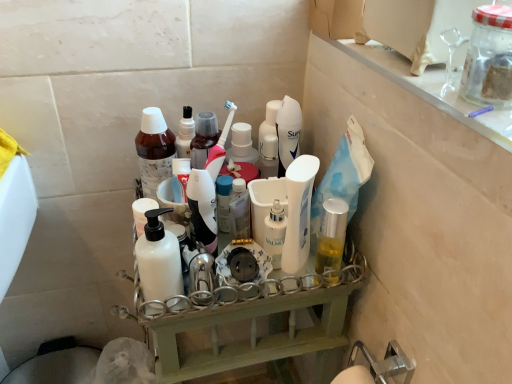
Image resolution: width=512 pixels, height=384 pixels. I want to click on white matte bottle at center, which ranks as the first bottle in bottom-to-top order, so click(158, 262).

What do you see at coordinates (298, 212) in the screenshot?
I see `white glossy lotion at center` at bounding box center [298, 212].

Find the location of `white glossy lotion at center`. white glossy lotion at center is located at coordinates (298, 212).

Measure the distance between point (276, 266) and camera.

Point (276, 266) is 28.07 inches away from camera.

You are a GUI agent. You are given a task and a screenshot of the screen. Output one action in this format:
    pyautogui.click(x=<x>, y=<y>)
    Task: Click on the clear glass shelf at upper right
    This screenshot has width=512, height=384.
    Given the screenshot: What is the action you would take?
    pyautogui.click(x=426, y=87)

Is white glossy lotion at center, arranged as the 1th toiletry when viewed from the left, in front of or behind white glossy lotion at center in the image?

In the image, white glossy lotion at center, arranged as the 1th toiletry when viewed from the left, appears behind white glossy lotion at center.

Which is nearer, [197,184] or [286,271]?

The point [197,184] is closer.

Which of these two, white glossy lotion at center, placed as the second toiletry when sorted from right to left, or white glossy lotion at center, is smaller?

white glossy lotion at center, placed as the second toiletry when sorted from right to left.

Find the location of a particular element. This screenshot has height=384, width=512. cleaning product in front of the white glossy lotion at center, arranged as the 1th toiletry when viewed from the left is located at coordinates coord(298,212).

Considering the positions of points (327, 301) and (150, 145), is point (327, 301) farther from camera compared to point (150, 145)?

No, (327, 301) is in front of (150, 145).

From the picture: Does white plastic shelf at center come behind brown matte bottle at center, the first bottle in the top-to-bottom sequence?

No, white plastic shelf at center is closer to the viewer.

How different are the orientations of white plastic shelf at center and brown matte bottle at center, arranged as the 2th bottle when ordered from the bottom, in degrees?

There is a 90.6-degree angle between the facing directions of white plastic shelf at center and brown matte bottle at center, arranged as the 2th bottle when ordered from the bottom.

Which bottle is the 2nd one when counting from the left side of the white plastic shelf at center? Please provide its 2D coordinates.

[(154, 150)]

Considering the sizes of white glossy lotion at center, the 2th toiletry viewed from the left, and white glossy lotion at center, placed as the second toiletry when sorted from right to left, in the image, is white glossy lotion at center, the 2th toiletry viewed from the left, wider or thinner than white glossy lotion at center, placed as the second toiletry when sorted from right to left,?

white glossy lotion at center, the 2th toiletry viewed from the left, is thinner than white glossy lotion at center, placed as the second toiletry when sorted from right to left.

Which object is closer to the camera, white glossy lotion at center, the 2th toiletry viewed from the left, or white glossy lotion at center, arranged as the 1th toiletry when viewed from the left?

Positioned in front is white glossy lotion at center, arranged as the 1th toiletry when viewed from the left.

Is white glossy lotion at center, acting as the 1th toiletry starting from the right, touching white glossy lotion at center, placed as the second toiletry when sorted from right to left?

There is a gap between white glossy lotion at center, acting as the 1th toiletry starting from the right, and white glossy lotion at center, placed as the second toiletry when sorted from right to left.

Between white glossy lotion at center, acting as the 1th toiletry starting from the right, and white glossy lotion at center, placed as the second toiletry when sorted from right to left, which one has smaller size?

white glossy lotion at center, acting as the 1th toiletry starting from the right.

From a real-world perspective, between white plastic shelf at center and white glossy lotion at center, arranged as the 1th toiletry when viewed from the left, who is vertically higher?

white glossy lotion at center, arranged as the 1th toiletry when viewed from the left.

Is white plastic shelf at center positioned before white glossy lotion at center, arranged as the 1th toiletry when viewed from the left?

Yes, white plastic shelf at center is closer to the viewer.

Does white plastic shelf at center turn towards white glossy lotion at center, placed as the second toiletry when sorted from right to left?

No.

Starting from the white plastic shelf at center, which toiletry is the 1st one behind? Please provide its 2D coordinates.

[(203, 209)]

From a real-world perspective, is white glossy lotion at center positioned under white matte bottle at center, arranged as the 2th bottle when viewed from the top, based on gravity?

Actually, white glossy lotion at center is physically above white matte bottle at center, arranged as the 2th bottle when viewed from the top, in the real world.

Which object is wider, white glossy lotion at center or white matte bottle at center, arranged as the 2th bottle when viewed from the top?

white matte bottle at center, arranged as the 2th bottle when viewed from the top, is wider.

Can you tell me how much white glossy lotion at center and white matte bottle at center, which ranks as the first bottle in bottom-to-top order, differ in facing direction?

The angular difference between white glossy lotion at center and white matte bottle at center, which ranks as the first bottle in bottom-to-top order, is 35.7 degrees.

From the white glossy lotion at center, count the 1st bottle to the left and point to it. Please provide its 2D coordinates.

[(158, 262)]

Considering the relative positions of brown matte bottle at center, the 1th bottle viewed from the back, and white glossy lotion at center, the 2th toiletry viewed from the left, in the image provided, is brown matte bottle at center, the 1th bottle viewed from the back, to the right of white glossy lotion at center, the 2th toiletry viewed from the left, from the viewer's perspective?

No, brown matte bottle at center, the 1th bottle viewed from the back, is not to the right of white glossy lotion at center, the 2th toiletry viewed from the left.

From a real-world perspective, is brown matte bottle at center, the 1th bottle viewed from the back, positioned under white glossy lotion at center, the 2th toiletry viewed from the left, based on gravity?

No, from a real-world perspective, brown matte bottle at center, the 1th bottle viewed from the back, is not below white glossy lotion at center, the 2th toiletry viewed from the left.

Is brown matte bottle at center, the first bottle in the top-to-bottom sequence, oriented towards white glossy lotion at center, the 2th toiletry viewed from the left?

No, brown matte bottle at center, the first bottle in the top-to-bottom sequence, is not oriented towards white glossy lotion at center, the 2th toiletry viewed from the left.

Can you confirm if brown matte bottle at center, the 1th bottle viewed from the back, is taller than white glossy lotion at center, acting as the 1th toiletry starting from the right?

Yes.

Between point (311, 53) and point (152, 347), which one is positioned behind?

The point (311, 53) is more distant.

From the image's perspective, is clear glass shelf at upper right located above or below white plastic shelf at center?

From the image's perspective, clear glass shelf at upper right appears above white plastic shelf at center.

You are a GUI agent. You are given a task and a screenshot of the screen. Output one action in this format:
    pyautogui.click(x=<x>, y=<y>)
    Task: Click on the shelf that appears on the left of clear glass shelf at upper right
    
    Given the screenshot: What is the action you would take?
    pyautogui.click(x=251, y=321)

Considering the sizes of clear glass shelf at upper right and white plastic shelf at center in the image, is clear glass shelf at upper right taller or shorter than white plastic shelf at center?

In the image, clear glass shelf at upper right appears to be shorter than white plastic shelf at center.

Locate an element on the screen. cleaning product that is on the right side of white glossy lotion at center, arranged as the 1th toiletry when viewed from the left is located at coordinates (298, 212).

You are a GUI agent. You are given a task and a screenshot of the screen. Output one action in this format:
    pyautogui.click(x=<x>, y=<y>)
    Task: Click on the shelf that is in front of the brown matte bottle at center, the 1th bottle viewed from the back
    This screenshot has height=384, width=512.
    Given the screenshot: What is the action you would take?
    pyautogui.click(x=251, y=321)

Estimate the real-world distances between objects in this image. Which object is further from white matte bottle at center, arranged as the 2th bottle when viewed from the top, white glossy lotion at center or brown matte bottle at center, the 1th bottle viewed from the back?

The object further to white matte bottle at center, arranged as the 2th bottle when viewed from the top, is white glossy lotion at center.

Looking at the image, which one is located closer to white plastic shelf at center, brown matte bottle at center, the 1th bottle viewed from the back, or white matte bottle at center, the 1th bottle positioned from the front?

white matte bottle at center, the 1th bottle positioned from the front, is closer to white plastic shelf at center.

Based on their spatial positions, is white glossy lotion at center or brown matte bottle at center, which is the second bottle from front to back, closer to white plastic shelf at center?

Based on the image, white glossy lotion at center appears to be nearer to white plastic shelf at center.

Looking at this image, estimate the real-world distances between objects in this image. Which object is closer to clear glass shelf at upper right, white matte bottle at center, marked as the second bottle in a back-to-front arrangement, or white glossy lotion at center, acting as the 1th toiletry starting from the right?

white glossy lotion at center, acting as the 1th toiletry starting from the right, lies closer to clear glass shelf at upper right than the other object.

Looking at the image, which one is located further to brown matte bottle at center, arranged as the 2th bottle when ordered from the bottom, white glossy lotion at center, arranged as the 1th toiletry when viewed from the left, or white plastic shelf at center?

Among the two, white plastic shelf at center is located further to brown matte bottle at center, arranged as the 2th bottle when ordered from the bottom.

Based on their spatial positions, is white glossy lotion at center or white glossy lotion at center, the 2th toiletry viewed from the left, further from white plastic shelf at center?

Among the two, white glossy lotion at center, the 2th toiletry viewed from the left, is located further to white plastic shelf at center.

Looking at the image, which one is located further to clear glass shelf at upper right, brown matte bottle at center, the first bottle in the top-to-bottom sequence, or white glossy lotion at center?

Based on the image, brown matte bottle at center, the first bottle in the top-to-bottom sequence, appears to be further to clear glass shelf at upper right.

Which object lies further to the anchor point white matte bottle at center, the 1th bottle positioned from the front, white glossy lotion at center, the 2th toiletry viewed from the left, or clear glass shelf at upper right?

clear glass shelf at upper right is further to white matte bottle at center, the 1th bottle positioned from the front.

This screenshot has width=512, height=384. In order to click on toiletry situated between white matte bottle at center, which ranks as the first bottle in bottom-to-top order, and white glossy lotion at center, acting as the 1th toiletry starting from the right, from left to right in this screenshot , I will do `click(203, 209)`.

The width and height of the screenshot is (512, 384). I want to click on cleaning product located between brown matte bottle at center, the 1th bottle viewed from the back, and clear glass shelf at upper right in the left-right direction, so click(298, 212).

Where is `bottle situated between brown matte bottle at center, the 1th bottle viewed from the back, and white glossy lotion at center, acting as the 1th toiletry starting from the right, from left to right`? bottle situated between brown matte bottle at center, the 1th bottle viewed from the back, and white glossy lotion at center, acting as the 1th toiletry starting from the right, from left to right is located at coordinates (158, 262).

At what (x,y) coordinates should I click in order to perform the action: click on bottle that lies between white glossy lotion at center and white plastic shelf at center from top to bottom. Please return your answer as a coordinate pair (x, y). Image resolution: width=512 pixels, height=384 pixels. Looking at the image, I should click on (158, 262).